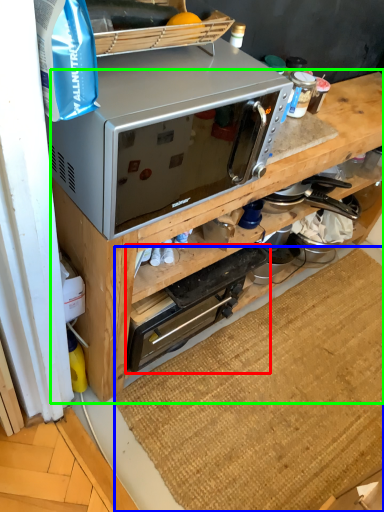
Question: Which object is the farthest from appliance (highlighted by a red box)? Choose among these: doormat (highlighted by a blue box) or cabinetry (highlighted by a green box).

Choices:
 (A) doormat
 (B) cabinetry

Answer: (A)